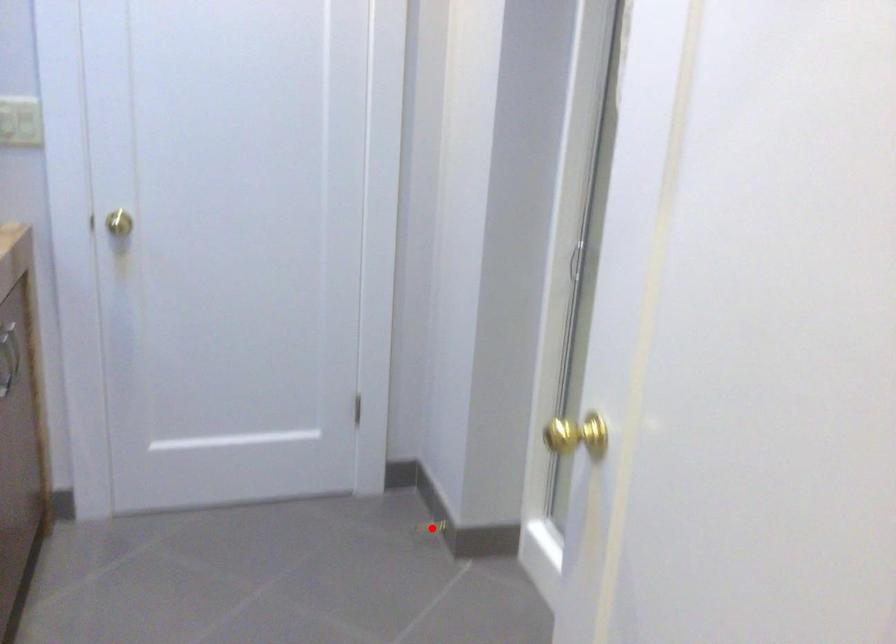
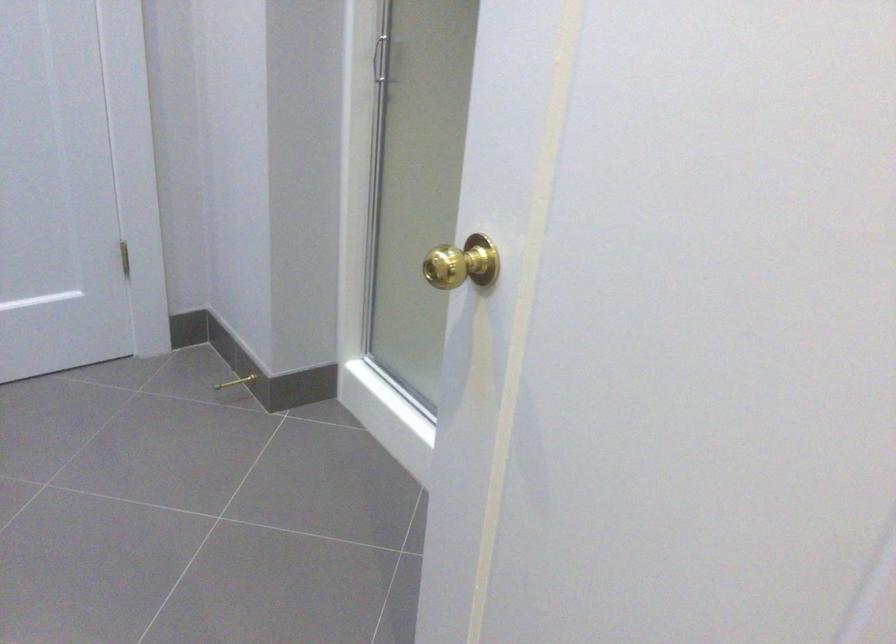
Find the pixel in the second image that matches the highlighted location in the first image.

(235, 382)